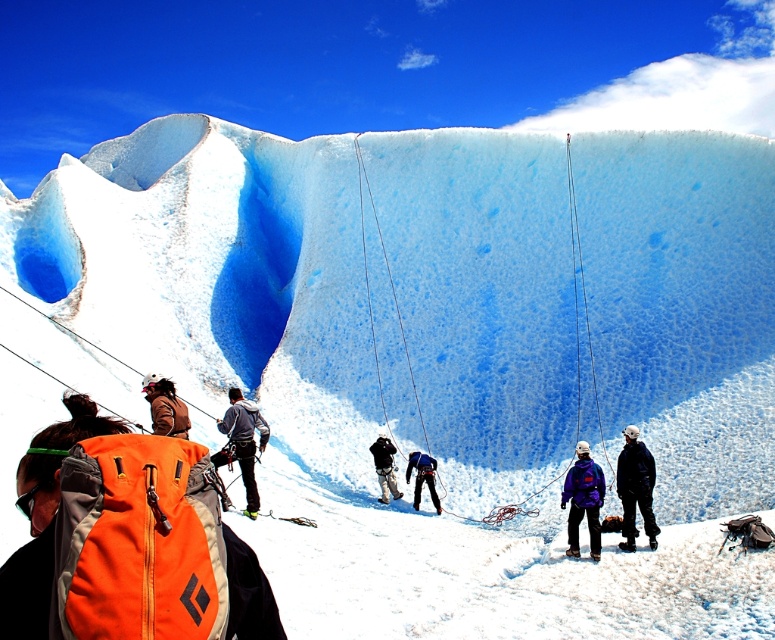
Is black matte jacket at center to the right of gray fabric jacket at center from the viewer's perspective?

Yes, black matte jacket at center is to the right of gray fabric jacket at center.

Which of these two, black matte jacket at center or gray fabric jacket at center, stands taller?

gray fabric jacket at center

Is point (634, 483) more distant than point (252, 456)?

No.

Where is `black matte jacket at center`? This screenshot has height=640, width=775. black matte jacket at center is located at coordinates (636, 486).

Can you confirm if orange fabric backpack at center is taller than purple fleece jacket at center?

Yes.

Does point (83, 524) come farther from viewer compared to point (589, 484)?

No, it is not.

Does point (145, 582) lie behind point (584, 481)?

No, it is in front of (584, 481).

Image resolution: width=775 pixels, height=640 pixels. I want to click on orange fabric backpack at center, so click(126, 541).

Which of these two, black matte jacket at center or blue fabric climbing harness at center, stands taller?

blue fabric climbing harness at center

Can you confirm if black matte jacket at center is positioned to the right of blue fabric climbing harness at center?

Yes, black matte jacket at center is to the right of blue fabric climbing harness at center.

Find the location of `black matte jacket at center`. black matte jacket at center is located at coordinates (636, 486).